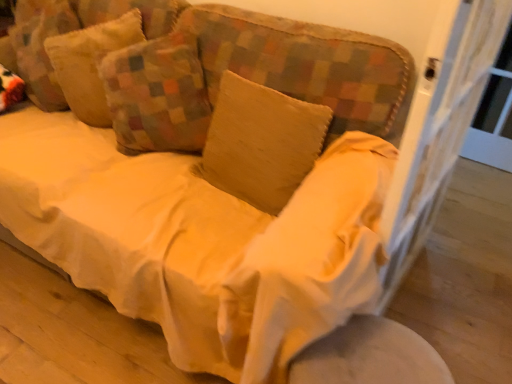
The height and width of the screenshot is (384, 512). What do you see at coordinates (438, 128) in the screenshot?
I see `white wood screen door at right` at bounding box center [438, 128].

Where is `textured beige pillow at upper left, which is counted as the second pillow, starting from the left`? This screenshot has width=512, height=384. textured beige pillow at upper left, which is counted as the second pillow, starting from the left is located at coordinates (157, 95).

In order to face textured beige pillow at upper left, the second pillow positioned from the right, should I rotate leftwards or rightwards?

To align with it, rotate left about 13.874°.

You are a GUI agent. You are given a task and a screenshot of the screen. Output one action in this format:
    pyautogui.click(x=<x>, y=<y>)
    Task: Click on the textured beige pillow at upper left, the 3th pillow from the right
    The width and height of the screenshot is (512, 384).
    Given the screenshot: What is the action you would take?
    pyautogui.click(x=90, y=63)

The image size is (512, 384). Identify the location of pillow on the left of textured beige pillow at upper left, which is counted as the second pillow, starting from the left. (90, 63).

Which is more to the right, textured beige pillow at upper left, the 3th pillow from the right, or textured beige pillow at upper left, the second pillow positioned from the right?

textured beige pillow at upper left, the second pillow positioned from the right, is more to the right.

Does textured beige pillow at upper left, the second pillow positioned from the right, turn towards textured beige pillow at upper left, the 3th pillow from the right?

No, textured beige pillow at upper left, the second pillow positioned from the right, is not aimed at textured beige pillow at upper left, the 3th pillow from the right.

How many degrees apart are the facing directions of textured beige pillow at upper left, which is counted as the second pillow, starting from the left, and textured beige pillow at upper left, the 1th pillow when ordered from left to right?

3.95 degrees.

Is textured beige pillow at upper left, the second pillow positioned from the right, touching textured beige pillow at upper left, the 1th pillow when ordered from left to right?

textured beige pillow at upper left, the second pillow positioned from the right, and textured beige pillow at upper left, the 1th pillow when ordered from left to right, are clearly separated.

Which is less distant, (197,76) or (103,127)?

Point (197,76).

Does point (484, 22) come in front of point (166, 75)?

Yes, point (484, 22) is in front of point (166, 75).

Looking at this image, do you think white wood screen door at right is within textured beige pillow at upper left, the second pillow positioned from the right, or outside of it?

white wood screen door at right lies outside textured beige pillow at upper left, the second pillow positioned from the right.

Are white wood screen door at right and textured beige pillow at upper left, which is counted as the second pillow, starting from the left, located far from each other?

No, white wood screen door at right is not far from textured beige pillow at upper left, which is counted as the second pillow, starting from the left.

Could you tell me if white wood screen door at right is turned towards textured beige pillow at upper left, the second pillow positioned from the right?

No, white wood screen door at right is not oriented towards textured beige pillow at upper left, the second pillow positioned from the right.

From a real-world perspective, between textured beige pillow at upper left, the 3th pillow from the right, and white wood screen door at right, who is vertically lower?

In real-world perspective, white wood screen door at right is lower.

From the picture: Is textured beige pillow at upper left, the 3th pillow from the right, looking in the opposite direction of white wood screen door at right?

No, white wood screen door at right is not at the back of textured beige pillow at upper left, the 3th pillow from the right.

From the image's perspective, which is above, textured beige pillow at upper left, the 3th pillow from the right, or white wood screen door at right?

From the image's view, textured beige pillow at upper left, the 3th pillow from the right, is above.

Considering their positions, is textured beige pillow at upper left, which is counted as the second pillow, starting from the left, located in front of or behind beige cotton pillow at center, arranged as the 1th pillow when viewed from the right?

textured beige pillow at upper left, which is counted as the second pillow, starting from the left, is positioned farther from the viewer than beige cotton pillow at center, arranged as the 1th pillow when viewed from the right.

Is textured beige pillow at upper left, which is counted as the second pillow, starting from the left, spatially inside beige cotton pillow at center, arranged as the 1th pillow when viewed from the right, or outside of it?

textured beige pillow at upper left, which is counted as the second pillow, starting from the left, is located beyond the bounds of beige cotton pillow at center, arranged as the 1th pillow when viewed from the right.

Which object is thinner, textured beige pillow at upper left, the second pillow positioned from the right, or beige cotton pillow at center, marked as the third pillow in a left-to-right arrangement?

With smaller width is beige cotton pillow at center, marked as the third pillow in a left-to-right arrangement.

Is point (119, 54) more distant than point (233, 148)?

Yes.

Which is correct: white fabric round table at lower right is inside textured beige pillow at upper left, the 1th pillow when ordered from left to right, or outside of it?

The correct answer is: outside.

Is there a large distance between white fabric round table at lower right and textured beige pillow at upper left, the 1th pillow when ordered from left to right?

Yes.

Where is `round table in front of the textured beige pillow at upper left, the 3th pillow from the right`? Image resolution: width=512 pixels, height=384 pixels. round table in front of the textured beige pillow at upper left, the 3th pillow from the right is located at coordinates (369, 356).

Measure the distance from white fabric round table at lower right to textured beige pillow at upper left, the 1th pillow when ordered from left to right.

They are 1.25 meters apart.

From the white wood screen door at right, count 3rd pillows backward and point to it. Please provide its 2D coordinates.

[(90, 63)]

From a real-world perspective, is white wood screen door at right located higher than textured beige pillow at upper left, the 3th pillow from the right?

Actually, white wood screen door at right is physically below textured beige pillow at upper left, the 3th pillow from the right, in the real world.

Does white wood screen door at right lie in front of textured beige pillow at upper left, the 3th pillow from the right?

Yes, white wood screen door at right is closer to the camera.

In order to click on pillow that is the 1st object to the right of the textured beige pillow at upper left, the 1th pillow when ordered from left to right, starting at the anchor in this screenshot , I will do `click(157, 95)`.

Identify the location of the 1st pillow in front of the textured beige pillow at upper left, the 1th pillow when ordered from left to right, starting your count from the anchor. The height and width of the screenshot is (384, 512). (157, 95).

When comparing their distances from white wood screen door at right, does white fabric round table at lower right or textured beige pillow at upper left, the 1th pillow when ordered from left to right, seem closer?

white fabric round table at lower right.

Based on their spatial positions, is textured beige pillow at upper left, the second pillow positioned from the right, or beige cotton pillow at center, marked as the third pillow in a left-to-right arrangement, closer to white fabric round table at lower right?

Based on the image, beige cotton pillow at center, marked as the third pillow in a left-to-right arrangement, appears to be nearer to white fabric round table at lower right.

Which object lies nearer to the anchor point white wood screen door at right, white fabric round table at lower right or textured beige pillow at upper left, the second pillow positioned from the right?

white fabric round table at lower right lies closer to white wood screen door at right than the other object.

Which object lies nearer to the anchor point white wood screen door at right, white fabric round table at lower right or beige cotton pillow at center, arranged as the 1th pillow when viewed from the right?

white fabric round table at lower right is positioned closer to the anchor white wood screen door at right.

From the image, which object appears to be farther from white wood screen door at right, textured beige pillow at upper left, the second pillow positioned from the right, or white fabric round table at lower right?

textured beige pillow at upper left, the second pillow positioned from the right, is further to white wood screen door at right.

Looking at the image, which one is located closer to white fabric round table at lower right, textured beige pillow at upper left, the second pillow positioned from the right, or white wood screen door at right?

Among the two, white wood screen door at right is located nearer to white fabric round table at lower right.

When comparing their distances from beige cotton pillow at center, arranged as the 1th pillow when viewed from the right, does textured beige pillow at upper left, the second pillow positioned from the right, or white wood screen door at right seem closer?

textured beige pillow at upper left, the second pillow positioned from the right, lies closer to beige cotton pillow at center, arranged as the 1th pillow when viewed from the right, than the other object.

Looking at the image, which one is located closer to textured beige pillow at upper left, which is counted as the second pillow, starting from the left, white fabric round table at lower right or beige cotton pillow at center, marked as the third pillow in a left-to-right arrangement?

beige cotton pillow at center, marked as the third pillow in a left-to-right arrangement, is positioned closer to the anchor textured beige pillow at upper left, which is counted as the second pillow, starting from the left.

Locate an element on the screen. This screenshot has height=384, width=512. round table between textured beige pillow at upper left, the 3th pillow from the right, and white wood screen door at right, in the horizontal direction is located at coordinates (369, 356).

You are a GUI agent. You are given a task and a screenshot of the screen. Output one action in this format:
    pyautogui.click(x=<x>, y=<y>)
    Task: Click on the pillow between textured beige pillow at upper left, the 3th pillow from the right, and beige cotton pillow at center, marked as the third pillow in a left-to-right arrangement
    
    Given the screenshot: What is the action you would take?
    pyautogui.click(x=157, y=95)

Image resolution: width=512 pixels, height=384 pixels. What are the coordinates of `pillow between textured beige pillow at upper left, which is counted as the second pillow, starting from the left, and white fabric round table at lower right in the up-down direction` in the screenshot? It's located at (261, 142).

The height and width of the screenshot is (384, 512). Identify the location of screen door that lies between beige cotton pillow at center, arranged as the 1th pillow when viewed from the right, and white fabric round table at lower right from top to bottom. (438, 128).